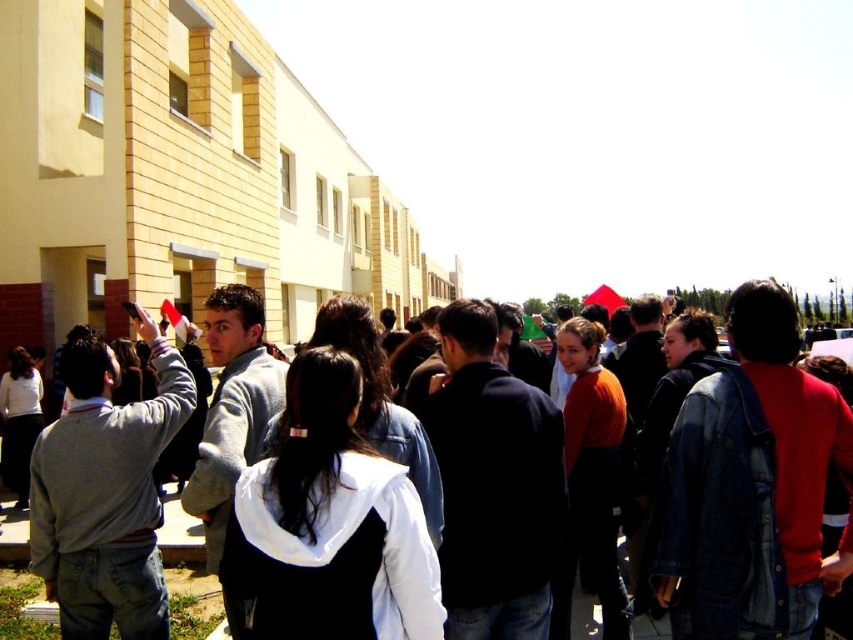
You are a photographer trying to capture a photo of the crowd. You notice two jackets at the center of the scene. Which jacket, the white matte jacket at center or the denim jacket at center, is taller and might block the view of someone behind it?

The white matte jacket at center has a greater height compared to the denim jacket at center, so it might block the view more than the denim jacket at center.

You are organizing a clothing display and need to place the white matte jacket at center and denim jacket at center on a shelf. The shelf has limited space, and you want to arrange them so that the smaller item is on the left side. Which jacket should you place on the left side?

The white matte jacket at center is smaller than the denim jacket at center, so you should place the white matte jacket at center on the left side of the shelf.

You are standing in the crowd at this event and notice two jackets at the center of the scene. Which jacket is positioned closer to you, the white matte jacket at center or the denim jacket at center?

The white matte jacket at center is closer to the viewer than the denim jacket at center, so the white matte jacket at center is positioned closer to you.